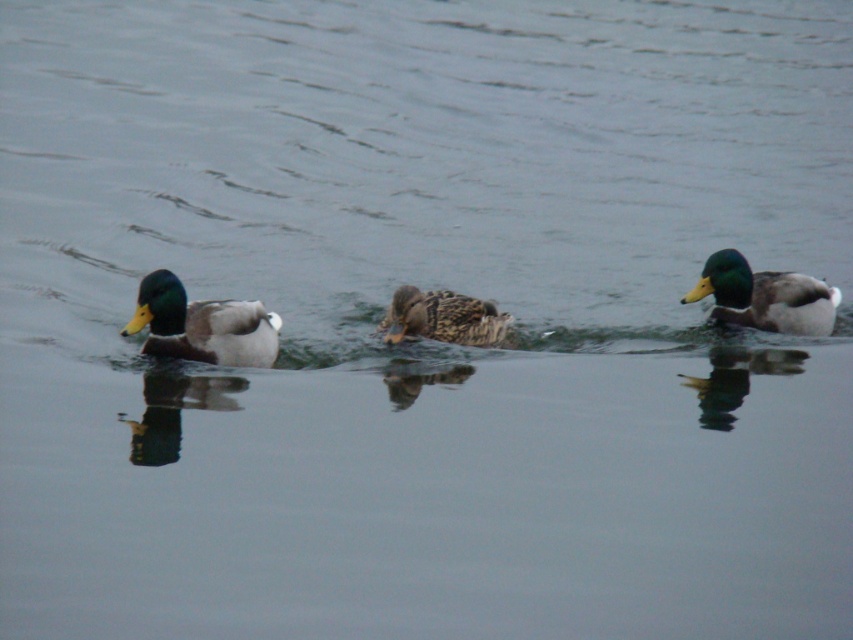
Who is taller, green glossy duck at right or brown speckled duck at center?

Standing taller between the two is green glossy duck at right.

What do you see at coordinates (764, 296) in the screenshot? I see `green glossy duck at right` at bounding box center [764, 296].

Locate an element on the screen. green glossy duck at right is located at coordinates (764, 296).

Between matte green duck at left and green glossy duck at right, which one appears on the left side from the viewer's perspective?

Positioned to the left is matte green duck at left.

Looking at this image, is the position of matte green duck at left less distant than that of green glossy duck at right?

Yes, it is.

Identify the location of matte green duck at left. The width and height of the screenshot is (853, 640). (202, 324).

Can you confirm if matte green duck at left is positioned above brown speckled duck at center?

No.

How distant is matte green duck at left from brown speckled duck at center?

A distance of 3.63 feet exists between matte green duck at left and brown speckled duck at center.

Which is in front, point (213, 332) or point (418, 316)?

Point (213, 332) is more forward.

Identify the location of matte green duck at left. (202, 324).